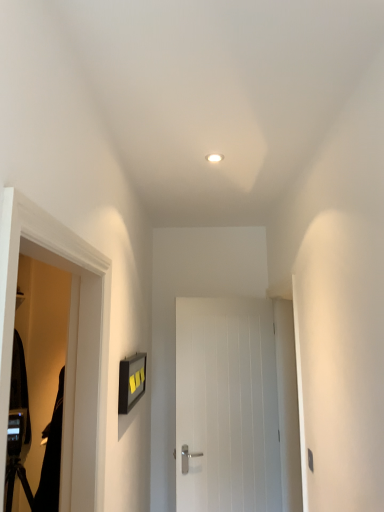
Question: From the image's perspective, would you say white wooden door at center is positioned over black matte screen door at left?

Choices:
 (A) no
 (B) yes

Answer: (A)

Question: Is white wooden door at center to the left of black matte screen door at left from the viewer's perspective?

Choices:
 (A) no
 (B) yes

Answer: (A)

Question: Considering the relative sizes of white wooden door at center and black matte screen door at left in the image provided, is white wooden door at center shorter than black matte screen door at left?

Choices:
 (A) no
 (B) yes

Answer: (A)

Question: Is white wooden door at center to the right of black matte screen door at left from the viewer's perspective?

Choices:
 (A) yes
 (B) no

Answer: (A)

Question: Is black matte screen door at left inside white wooden door at center?

Choices:
 (A) yes
 (B) no

Answer: (B)

Question: Does point (261, 429) appear closer or farther from the camera than point (44, 468)?

Choices:
 (A) closer
 (B) farther

Answer: (B)

Question: From a real-world perspective, is white wooden door at center above or below black matte robe at left?

Choices:
 (A) below
 (B) above

Answer: (B)

Question: Looking at their shapes, would you say white wooden door at center is wider or thinner than black matte robe at left?

Choices:
 (A) thin
 (B) wide

Answer: (A)

Question: Considering their positions, is white wooden door at center located in front of or behind black matte robe at left?

Choices:
 (A) behind
 (B) front

Answer: (A)

Question: Is black matte screen door at left bigger or smaller than white wooden door at center?

Choices:
 (A) big
 (B) small

Answer: (B)

Question: From the image's perspective, relative to white wooden door at center, is black matte screen door at left above or below?

Choices:
 (A) above
 (B) below

Answer: (A)

Question: Considering the relative positions of black matte screen door at left and white wooden door at center in the image provided, is black matte screen door at left to the left or to the right of white wooden door at center?

Choices:
 (A) right
 (B) left

Answer: (B)

Question: From their relative heights in the image, would you say black matte screen door at left is taller or shorter than white wooden door at center?

Choices:
 (A) tall
 (B) short

Answer: (B)

Question: Considering the positions of point (48, 486) and point (248, 482), is point (48, 486) closer or farther from the camera than point (248, 482)?

Choices:
 (A) farther
 (B) closer

Answer: (B)

Question: Based on their sizes in the image, would you say black matte robe at left is bigger or smaller than white wooden door at center?

Choices:
 (A) small
 (B) big

Answer: (A)